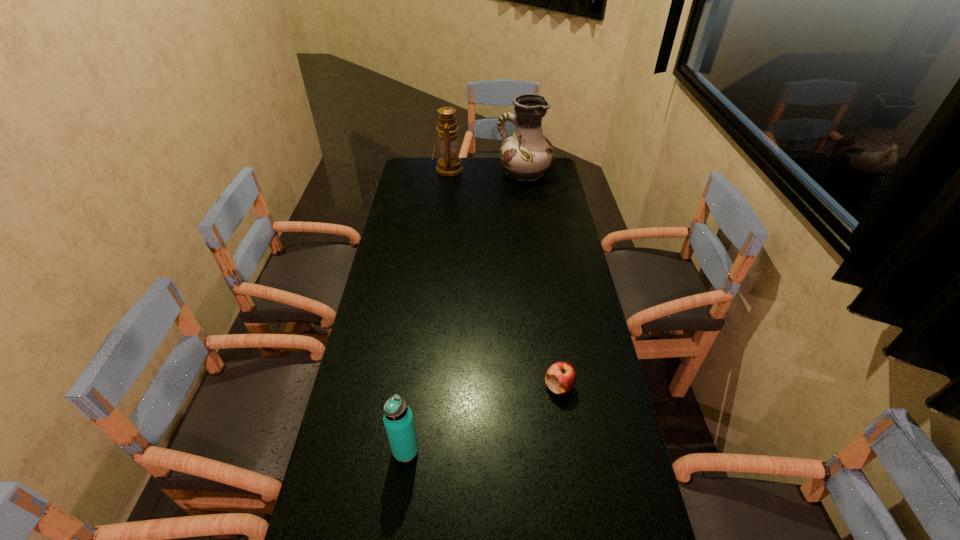
This screenshot has width=960, height=540. Find the location of `vacant space at the far left corner of the desktop`. vacant space at the far left corner of the desktop is located at coordinates point(412,165).

The image size is (960, 540). I want to click on vacant space at the far right corner, so click(527, 183).

Where is `empty space that is in between the vase and the nearest object`? empty space that is in between the vase and the nearest object is located at coordinates (465, 312).

The height and width of the screenshot is (540, 960). Identify the location of blank region between the vase and the water bottle. (465, 312).

Image resolution: width=960 pixels, height=540 pixels. I want to click on blank region between the third shortest object and the water bottle, so click(x=427, y=309).

The image size is (960, 540). Find the location of `empty space that is in between the oil lamp and the third tallest object`. empty space that is in between the oil lamp and the third tallest object is located at coordinates (427, 309).

Where is `free spot between the vase and the apple`? free spot between the vase and the apple is located at coordinates (541, 280).

Where is `empty space between the nearest object and the apple`? The image size is (960, 540). empty space between the nearest object and the apple is located at coordinates (482, 418).

Find the location of a particular element. empty location between the nearest object and the apple is located at coordinates (482, 418).

The image size is (960, 540). What are the coordinates of `vacant area between the shortest object and the vase` in the screenshot? It's located at (541, 280).